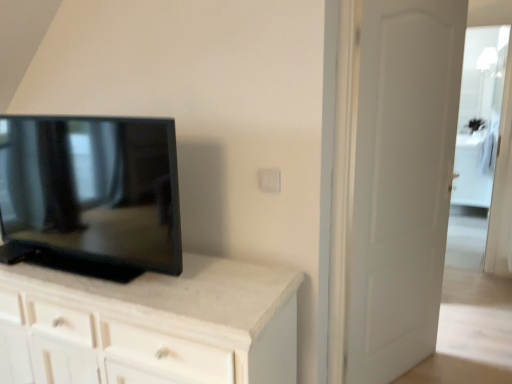
In order to click on transparent glass door at right in this screenshot , I will do `click(478, 138)`.

Consider the image. Considering the sizes of objects matte black tv at left and transparent glass door at right in the image provided, who is bigger, matte black tv at left or transparent glass door at right?

matte black tv at left.

Would you say matte black tv at left is inside or outside transparent glass door at right?

matte black tv at left is not inside transparent glass door at right, it's outside.

Between matte black tv at left and transparent glass door at right, which one is positioned behind?

transparent glass door at right is further away from the camera.

Is matte black tv at left not near transparent glass door at right?

Yes, matte black tv at left is far from transparent glass door at right.

From a real-world perspective, is white matte door at right positioned above or below transparent glass door at right?

Clearly, from a real-world perspective, white matte door at right is below transparent glass door at right.

Which object is further away from the camera taking this photo, white matte door at right or transparent glass door at right?

transparent glass door at right.

Consider the image. Measure the distance from white matte door at right to transparent glass door at right.

4.19 meters.

Is white matte door at right with transparent glass door at right?

There is a gap between white matte door at right and transparent glass door at right.

Is transparent glass door at right looking in the opposite direction of white matte door at right?

No, transparent glass door at right is not facing away from white matte door at right.

Visually, is transparent glass door at right positioned to the left or to the right of white matte door at right?

transparent glass door at right is positioned on white matte door at right's right side.

In the image, is transparent glass door at right positioned in front of or behind white matte door at right?

Visually, transparent glass door at right is located behind white matte door at right.

Can you confirm if transparent glass door at right is positioned to the left of matte black tv at left?

No.

How different are the orientations of transparent glass door at right and matte black tv at left in degrees?

There is a 0.651-degree angle between the facing directions of transparent glass door at right and matte black tv at left.

Could you tell me if transparent glass door at right is facing matte black tv at left?

No, transparent glass door at right is not oriented towards matte black tv at left.

Between point (476, 160) and point (25, 228), which one is positioned behind?

The point (476, 160) is farther.

Between matte black tv at left and white matte door at right, which one appears on the left side from the viewer's perspective?

matte black tv at left is more to the left.

Is white matte door at right at the back of matte black tv at left?

matte black tv at left does not have its back to white matte door at right.

Considering the positions of point (92, 204) and point (401, 327), is point (92, 204) closer or farther from the camera than point (401, 327)?

Clearly, point (92, 204) is closer to the camera than point (401, 327).

From a real-world perspective, does white matte door at right sit lower than matte black tv at left?

Correct, in the physical world, white matte door at right is lower than matte black tv at left.

Is white matte door at right taller than matte black tv at left?

Yes.

Is white matte door at right positioned before matte black tv at left?

No, the depth of white matte door at right is greater than that of matte black tv at left.

Image resolution: width=512 pixels, height=384 pixels. What are the coordinates of `television that is below the transparent glass door at right (from the image's perspective)` in the screenshot? It's located at (93, 188).

This screenshot has width=512, height=384. Identify the location of door that appears in front of the transparent glass door at right. (394, 179).

Based on their spatial positions, is white matte door at right or matte black tv at left further from transparent glass door at right?

The object further to transparent glass door at right is matte black tv at left.

Estimate the real-world distances between objects in this image. Which object is further from matte black tv at left, transparent glass door at right or white matte door at right?

Based on the image, transparent glass door at right appears to be further to matte black tv at left.

Looking at the image, which one is located further to transparent glass door at right, matte black tv at left or white matte door at right?

matte black tv at left lies further to transparent glass door at right than the other object.

Looking at the image, which one is located further to white matte door at right, matte black tv at left or transparent glass door at right?

transparent glass door at right is positioned further to the anchor white matte door at right.

When comparing their distances from white matte door at right, does transparent glass door at right or matte black tv at left seem closer?

The object closer to white matte door at right is matte black tv at left.

From the image, which object appears to be farther from matte black tv at left, white matte door at right or transparent glass door at right?

Among the two, transparent glass door at right is located further to matte black tv at left.

You are a GUI agent. You are given a task and a screenshot of the screen. Output one action in this format:
    pyautogui.click(x=<x>, y=<y>)
    Task: Click on the door between matte black tv at left and transparent glass door at right
    
    Given the screenshot: What is the action you would take?
    pyautogui.click(x=394, y=179)